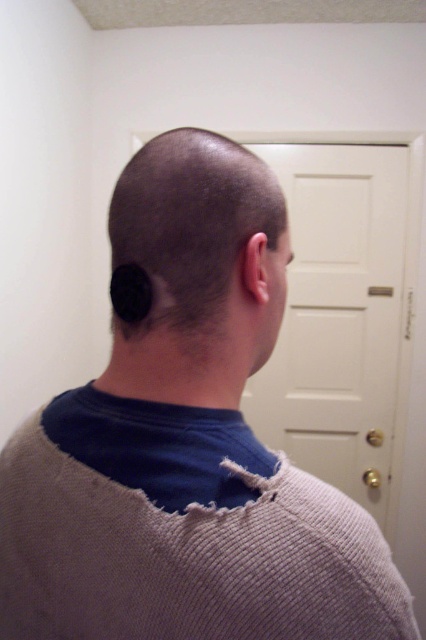
Question: Can you confirm if white matte door at center is positioned to the left of black matte hair at center?

Choices:
 (A) yes
 (B) no

Answer: (B)

Question: Does woolen sweater at back lie in front of black matte hair at back?

Choices:
 (A) yes
 (B) no

Answer: (A)

Question: Which object is closer to the camera taking this photo?

Choices:
 (A) woolen sweater at back
 (B) white matte door at center

Answer: (A)

Question: Estimate the real-world distances between objects in this image. Which object is farther from the black matte hair at center?

Choices:
 (A) black matte hair at back
 (B) woolen sweater at back
 (C) white matte door at center

Answer: (C)

Question: Can you confirm if woolen sweater at back is wider than black matte hair at back?

Choices:
 (A) no
 (B) yes

Answer: (B)

Question: Among these objects, which one is nearest to the camera?

Choices:
 (A) woolen sweater at back
 (B) white matte door at center
 (C) black matte hair at back
 (D) black matte hair at center

Answer: (A)